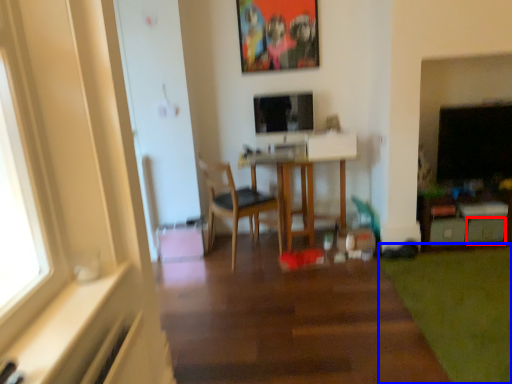
Question: Which point is closer to the camera, drawer (highlighted by a red box) or grass (highlighted by a blue box)?

Choices:
 (A) drawer
 (B) grass

Answer: (B)